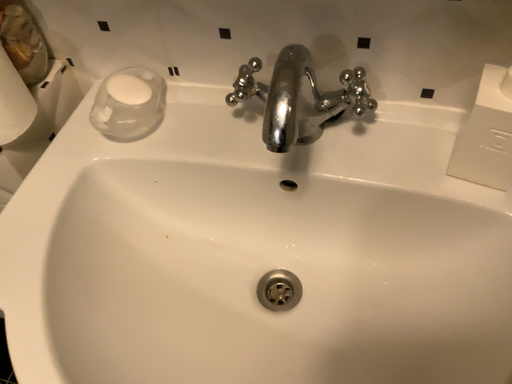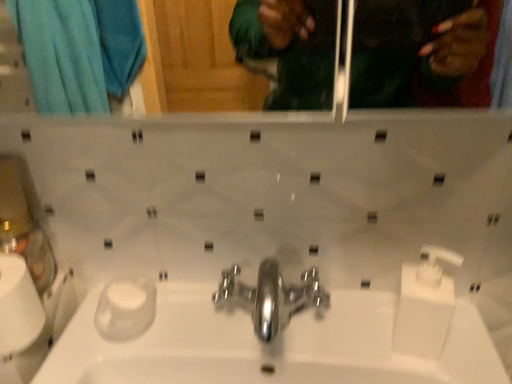
Question: Which way did the camera rotate in the video?

Choices:
 (A) rotated right
 (B) rotated left

Answer: (A)